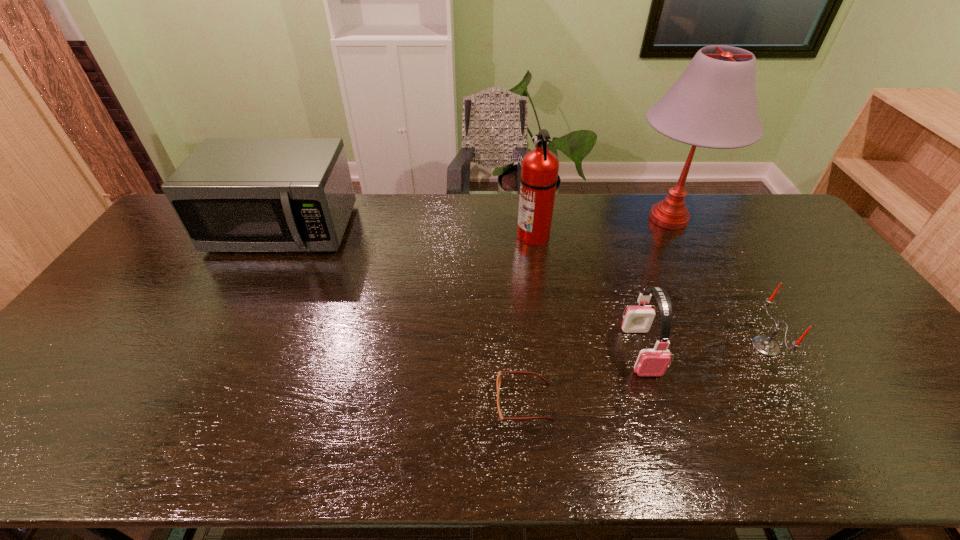
At what (x,y) coordinates should I click in order to perform the action: click on free space located 0.150m on the front-facing side of the spectacles. Please return your answer as a coordinate pair (x, y). Looking at the image, I should click on (433, 402).

Where is `vacant space situated 0.400m on the front-facing side of the spectacles`? vacant space situated 0.400m on the front-facing side of the spectacles is located at coordinates (326, 402).

Locate an element on the screen. The width and height of the screenshot is (960, 540). vacant space located on the front-facing side of the spectacles is located at coordinates (356, 402).

The width and height of the screenshot is (960, 540). What are the coordinates of `table lamp positioned at the far edge` in the screenshot? It's located at (713, 104).

Find the location of a particular element. fire extinguisher present at the far edge is located at coordinates (539, 174).

Identify the location of microwave oven that is at the far edge. Image resolution: width=960 pixels, height=540 pixels. (231, 194).

At what (x,y) coordinates should I click in order to perform the action: click on object that is at the near edge. Please return your answer as a coordinate pair (x, y). The height and width of the screenshot is (540, 960). Looking at the image, I should click on (498, 382).

You are a GUI agent. You are given a task and a screenshot of the screen. Output one action in this format:
    pyautogui.click(x=<x>, y=<y>)
    Task: Click on the free space at the far edge of the desktop
    The image size is (960, 540).
    Given the screenshot: What is the action you would take?
    pyautogui.click(x=697, y=217)

In order to click on vacant space at the near edge of the desktop in this screenshot , I will do `click(243, 447)`.

The height and width of the screenshot is (540, 960). I want to click on free spot at the left edge of the desktop, so click(x=86, y=355).